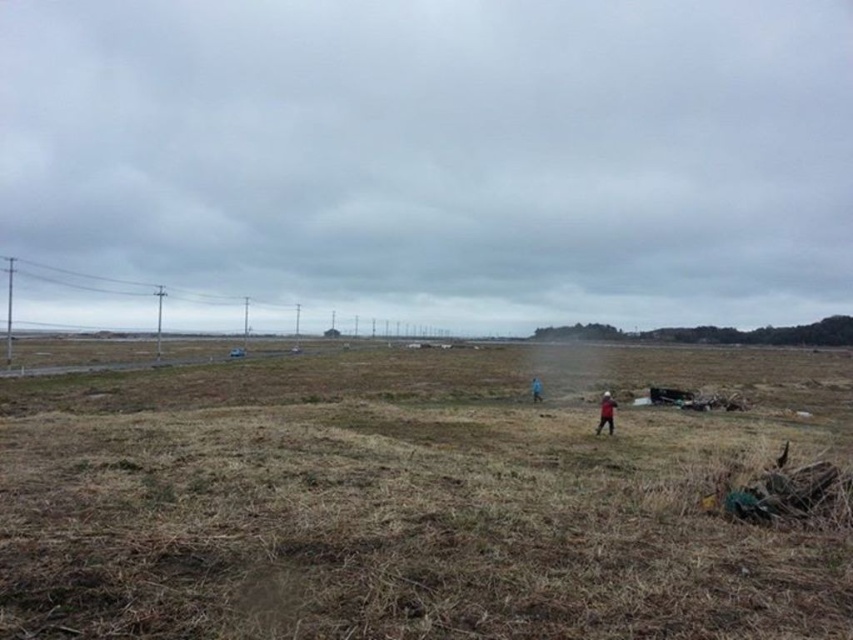
Between brown grassy field at center and dark red fabric at center, which one appears on the left side from the viewer's perspective?

brown grassy field at center

Can you confirm if brown grassy field at center is bigger than dark red fabric at center?

Yes, brown grassy field at center is bigger than dark red fabric at center.

The width and height of the screenshot is (853, 640). Identify the location of brown grassy field at center. (410, 499).

Image resolution: width=853 pixels, height=640 pixels. What are the coordinates of `brown grassy field at center` in the screenshot? It's located at (410, 499).

Which of these two, dark red fabric at center or blue fabric person at center, stands shorter?

dark red fabric at center

Between dark red fabric at center and blue fabric person at center, which one is positioned lower?

blue fabric person at center is below.

Locate an element on the screen. The image size is (853, 640). dark red fabric at center is located at coordinates 606,413.

Is brown grassy field at center closer to the viewer compared to blue fabric person at center?

Yes, it is in front of blue fabric person at center.

Between point (440, 372) and point (532, 390), which one is positioned in front?

Positioned in front is point (532, 390).

This screenshot has height=640, width=853. What are the coordinates of `brown grassy field at center` in the screenshot? It's located at (410, 499).